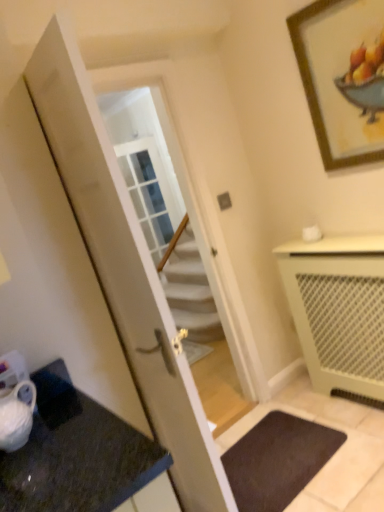
Question: In terms of height, does dark brown carpet at lower center look taller or shorter compared to beige mesh radiator at lower right?

Choices:
 (A) tall
 (B) short

Answer: (B)

Question: In the image, is dark brown carpet at lower center on the left side or the right side of beige mesh radiator at lower right?

Choices:
 (A) right
 (B) left

Answer: (B)

Question: Which is nearer to the wooden framed artwork at upper right?

Choices:
 (A) dark brown carpet at lower center
 (B) beige mesh radiator at lower right
 (C) white glossy door at center

Answer: (B)

Question: Which is farther from the beige mesh radiator at lower right?

Choices:
 (A) wooden framed artwork at upper right
 (B) dark brown carpet at lower center
 (C) white glossy door at center

Answer: (C)